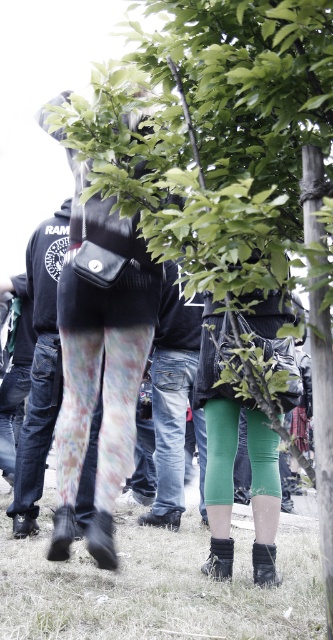
You are standing at the point labeled as point (54, 596) in the image. You want to move towards the tree in the background. Is there enough space to walk straight ahead without hitting the tree?

The distance between you and the tree is 3.17 meters, so there is enough space to walk straight ahead without hitting the tree.

What is the 2D coordinate of the green leafy tree at center in the image?

The green leafy tree at center is located at the 2D coordinate point of (225, 150).

You are observing a group of people at a festival. You notice two items on the ground in front of you. One is jeans at center and the other is black suede sock at lower center. Which item takes up more space visually?

The jeans at center takes up more space visually because it is bigger than the black suede sock at lower center.